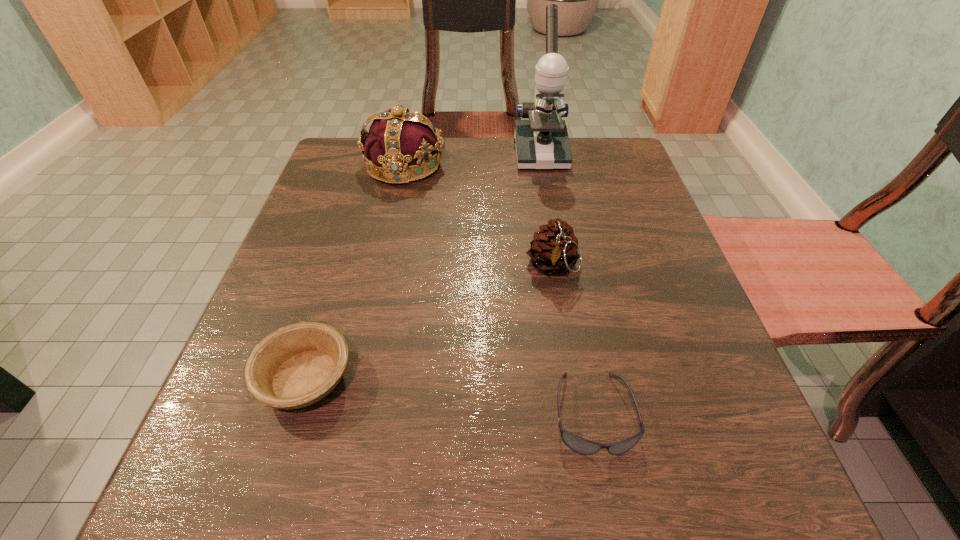
Identify the location of free point at the far edge. The height and width of the screenshot is (540, 960). (515, 188).

This screenshot has height=540, width=960. In the image, there is a desktop. Find the location of `vacant region at the near edge`. vacant region at the near edge is located at coordinates (452, 475).

Image resolution: width=960 pixels, height=540 pixels. I want to click on vacant region at the left edge of the desktop, so click(x=230, y=369).

Locate an element on the screen. This screenshot has height=540, width=960. vacant region at the right edge of the desktop is located at coordinates (642, 308).

Where is `free region at the far left corner of the desktop`? The height and width of the screenshot is (540, 960). free region at the far left corner of the desktop is located at coordinates (318, 178).

Find the location of a particular element. free location at the far right corner is located at coordinates (600, 175).

Image resolution: width=960 pixels, height=540 pixels. Identify the location of free space that is in between the shortest object and the third shortest object. (572, 340).

This screenshot has height=540, width=960. In order to click on vacant area that lies between the microscope and the sunglasses in this screenshot , I will do `click(566, 283)`.

Where is `free space between the third nearest object and the second tallest object`? free space between the third nearest object and the second tallest object is located at coordinates (x=478, y=216).

Identify the location of unoccupied area between the third farthest object and the bowl. (429, 322).